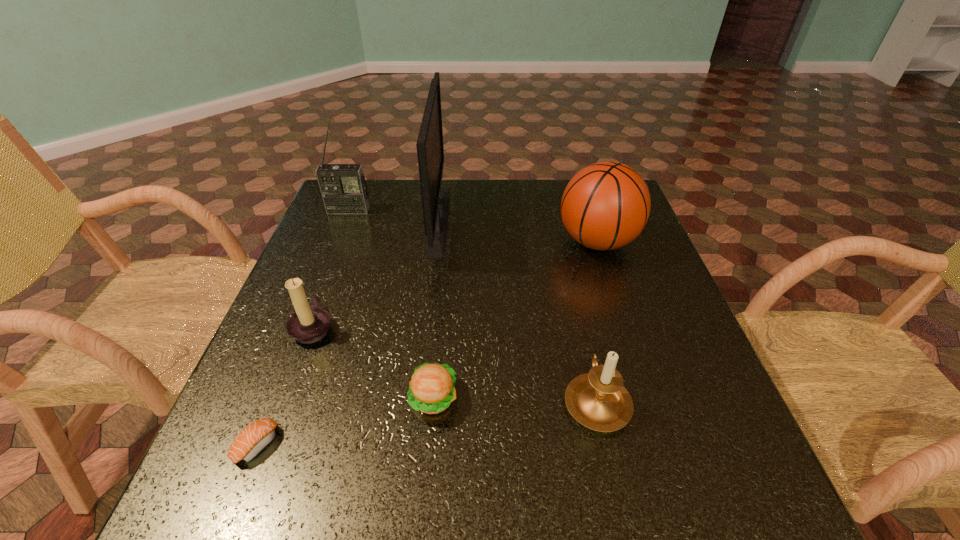
Locate an element on the screen. This screenshot has width=960, height=540. the tallest object is located at coordinates (435, 200).

Where is `the sixth shortest object`? This screenshot has height=540, width=960. the sixth shortest object is located at coordinates (344, 191).

Locate an element on the screen. The width and height of the screenshot is (960, 540). basketball is located at coordinates (606, 205).

Find the location of a particular element. Image resolution: width=960 pixels, height=540 pixels. the right candle holder is located at coordinates (598, 400).

The image size is (960, 540). I want to click on the fourth farthest object, so 309,324.

I want to click on the farther candle holder, so click(x=309, y=324).

At what (x,y) coordinates should I click in order to perform the action: click on hamburger. Please return your answer as a coordinate pair (x, y). Looking at the image, I should click on (431, 390).

Find the location of a particular element. The height and width of the screenshot is (540, 960). the shortest object is located at coordinates (256, 436).

In order to click on free space located on the front-facing side of the tallest object in this screenshot , I will do `click(497, 220)`.

You are a GUI agent. You are given a task and a screenshot of the screen. Output one action in this format:
    pyautogui.click(x=<x>, y=<y>)
    Task: Click on the free region located 0.320m on the display of the sixth shortest object
    The width and height of the screenshot is (960, 540).
    Given the screenshot: What is the action you would take?
    (x=317, y=292)